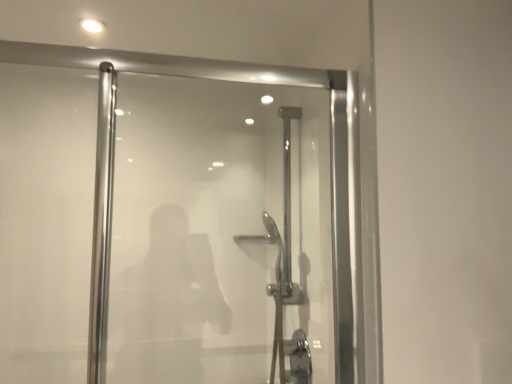
This screenshot has height=384, width=512. Identify the location of transparent glass shower door at center. (211, 233).

This screenshot has width=512, height=384. Describe the element at coordinates (211, 233) in the screenshot. I see `transparent glass shower door at center` at that location.

Locate an element on the screen. Image resolution: width=512 pixels, height=384 pixels. transparent glass shower door at center is located at coordinates (211, 233).